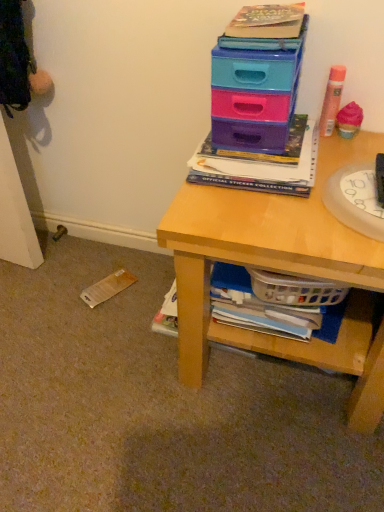
What do you see at coordinates (332, 100) in the screenshot? The height and width of the screenshot is (512, 384). I see `pink matte hair spray at upper right` at bounding box center [332, 100].

Where is `transparent plastic plate at right`? transparent plastic plate at right is located at coordinates (356, 200).

This screenshot has width=384, height=512. In order to click on matte plastic drawers at upper right in this screenshot , I will do `click(255, 91)`.

Consider the image. Considering the relative sizes of transparent plastic plate at right and pink matte hair spray at upper right in the image provided, is transparent plastic plate at right bigger than pink matte hair spray at upper right?

Indeed, transparent plastic plate at right has a larger size compared to pink matte hair spray at upper right.

Identify the location of stationery behind the transparent plastic plate at right. (332, 100).

Is transparent plastic plate at right placed right next to pink matte hair spray at upper right?

No, transparent plastic plate at right is not beside pink matte hair spray at upper right.

Is matte plastic drawers at upper right located within transparent plastic plate at right?

No, matte plastic drawers at upper right is not inside transparent plastic plate at right.

From the image's perspective, which one is positioned lower, transparent plastic plate at right or matte plastic drawers at upper right?

transparent plastic plate at right is shown below in the image.

Considering the positions of points (338, 178) and (223, 120), is point (338, 178) farther from camera compared to point (223, 120)?

No, it is in front of (223, 120).

Can you confirm if transparent plastic plate at right is positioned to the right of matte plastic drawers at upper right?

Correct, you'll find transparent plastic plate at right to the right of matte plastic drawers at upper right.

From a real-world perspective, is matte plastic drawers at upper right positioned under wooden desk at upper right based on gravity?

No.

From the image's perspective, who appears lower, matte plastic drawers at upper right or wooden desk at upper right?

From the image's view, wooden desk at upper right is below.

Would you say matte plastic drawers at upper right contains wooden desk at upper right?

No, matte plastic drawers at upper right does not contain wooden desk at upper right.

Based on the photo, considering the positions of objects matte plastic drawers at upper right and wooden desk at upper right in the image provided, who is in front, matte plastic drawers at upper right or wooden desk at upper right?

Positioned in front is wooden desk at upper right.

Which is more to the right, pink matte hair spray at upper right or transparent plastic plate at right?

Positioned to the right is transparent plastic plate at right.

Is pink matte hair spray at upper right smaller than transparent plastic plate at right?

Indeed, pink matte hair spray at upper right has a smaller size compared to transparent plastic plate at right.

Is pink matte hair spray at upper right with transparent plastic plate at right?

pink matte hair spray at upper right is not next to transparent plastic plate at right, and they're not touching.

Consider the image. Can you confirm if hardcover book at upper center is thinner than pink matte hair spray at upper right?

Incorrect, the width of hardcover book at upper center is not less than that of pink matte hair spray at upper right.

Is hardcover book at upper center inside or outside of pink matte hair spray at upper right?

hardcover book at upper center exists outside the volume of pink matte hair spray at upper right.

In the scene shown: Is the depth of hardcover book at upper center less than that of pink matte hair spray at upper right?

Yes, hardcover book at upper center is closer to the viewer.

From the image's perspective, is hardcover book at upper center above or below pink matte hair spray at upper right?

From the image's perspective, hardcover book at upper center appears below pink matte hair spray at upper right.

Locate an element on the screen. The height and width of the screenshot is (512, 384). paper plate above the hardcover book at upper center (from a real-world perspective) is located at coordinates (356, 200).

Considering the sizes of hardcover book at upper center and transparent plastic plate at right in the image, is hardcover book at upper center bigger or smaller than transparent plastic plate at right?

Considering their sizes, hardcover book at upper center takes up more space than transparent plastic plate at right.

From a real-world perspective, relative to transparent plastic plate at right, is hardcover book at upper center vertically above or below?

Clearly, from a real-world perspective, hardcover book at upper center is below transparent plastic plate at right.

Is point (354, 144) farther from viewer compared to point (221, 111)?

Yes.

From a real-world perspective, is wooden desk at upper right located higher than matte plastic drawers at upper right?

No, from a real-world perspective, wooden desk at upper right is not on top of matte plastic drawers at upper right.

Does wooden desk at upper right lie in front of matte plastic drawers at upper right?

Yes, the depth of wooden desk at upper right is less than that of matte plastic drawers at upper right.

Does wooden desk at upper right have a larger size compared to matte plastic drawers at upper right?

Yes.

This screenshot has height=512, width=384. In order to click on stationery behind the transparent plastic plate at right in this screenshot , I will do `click(332, 100)`.

Locate an element on the screen. The width and height of the screenshot is (384, 512). paper plate below the matte plastic drawers at upper right (from a real-world perspective) is located at coordinates (356, 200).

Based on their spatial positions, is transparent plastic plate at right or wooden desk at upper right further from pink matte hair spray at upper right?

wooden desk at upper right.

Which object lies nearer to the anchor point wooden desk at upper right, transparent plastic plate at right or hardcover book at upper center?

hardcover book at upper center.

From the image, which object appears to be farther from transparent plastic plate at right, pink matte hair spray at upper right or wooden desk at upper right?

Based on the image, pink matte hair spray at upper right appears to be further to transparent plastic plate at right.

When comparing their distances from hardcover book at upper center, does matte plastic drawers at upper right or pink matte hair spray at upper right seem further?

The object further to hardcover book at upper center is pink matte hair spray at upper right.

Based on their spatial positions, is matte plastic drawers at upper right or hardcover book at upper center closer to wooden desk at upper right?

The object closer to wooden desk at upper right is hardcover book at upper center.

Based on their spatial positions, is matte plastic drawers at upper right or transparent plastic plate at right further from wooden desk at upper right?

matte plastic drawers at upper right is positioned further to the anchor wooden desk at upper right.

Estimate the real-world distances between objects in this image. Which object is closer to matte plastic drawers at upper right, transparent plastic plate at right or hardcover book at upper center?

hardcover book at upper center is closer to matte plastic drawers at upper right.

Estimate the real-world distances between objects in this image. Which object is further from wooden desk at upper right, hardcover book at upper center or pink matte hair spray at upper right?

The object further to wooden desk at upper right is pink matte hair spray at upper right.

You are a GUI agent. You are given a task and a screenshot of the screen. Output one action in this format:
    pyautogui.click(x=<x>, y=<y>)
    Task: Click on the box situated between hardcover book at upper center and transparent plastic plate at right from left to right
    
    Given the screenshot: What is the action you would take?
    pyautogui.click(x=255, y=91)

Where is `book that lies between matte plastic drawers at upper right and wooden desk at upper right from top to bottom`? The width and height of the screenshot is (384, 512). book that lies between matte plastic drawers at upper right and wooden desk at upper right from top to bottom is located at coordinates (262, 165).

Identify the location of paper plate between matte plastic drawers at upper right and wooden desk at upper right from top to bottom. (356, 200).

The width and height of the screenshot is (384, 512). In order to click on book between pink matte hair spray at upper right and transparent plastic plate at right vertically in this screenshot , I will do `click(262, 165)`.